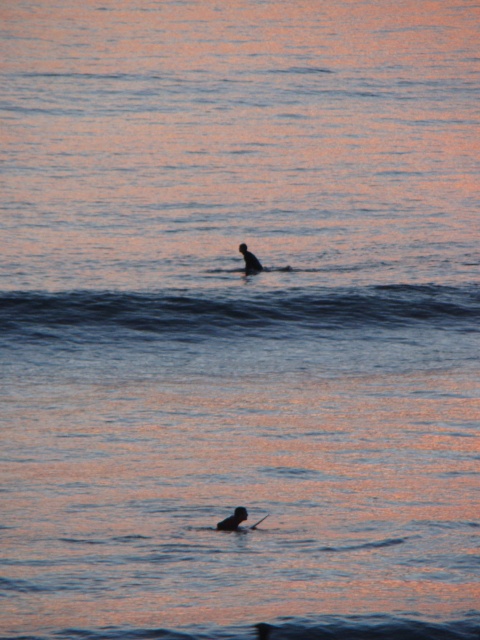
Question: Which point is farther to the camera?

Choices:
 (A) silhouette rubber surfboard at lower center
 (B) silhouette surfboard at center
 (C) smooth black paddle at lower center

Answer: (B)

Question: Is silhouette rubber surfboard at lower center thinner than smooth black paddle at lower center?

Choices:
 (A) no
 (B) yes

Answer: (A)

Question: Can you confirm if silhouette rubber surfboard at lower center is positioned to the right of smooth black paddle at lower center?

Choices:
 (A) yes
 (B) no

Answer: (B)

Question: Which point is farther from the camera taking this photo?

Choices:
 (A) (252, 260)
 (B) (259, 520)

Answer: (A)

Question: Which object is farther from the camera taking this photo?

Choices:
 (A) silhouette rubber surfboard at lower center
 (B) silhouette surfboard at center

Answer: (B)

Question: Is silhouette rubber surfboard at lower center positioned before smooth black paddle at lower center?

Choices:
 (A) no
 (B) yes

Answer: (B)